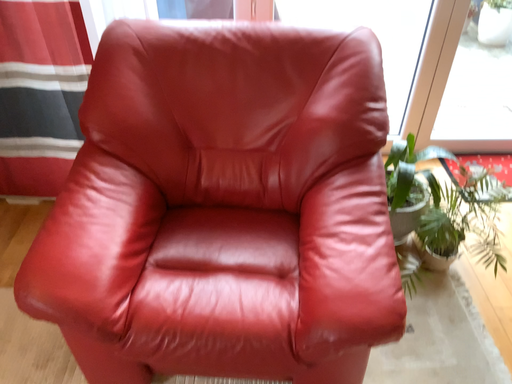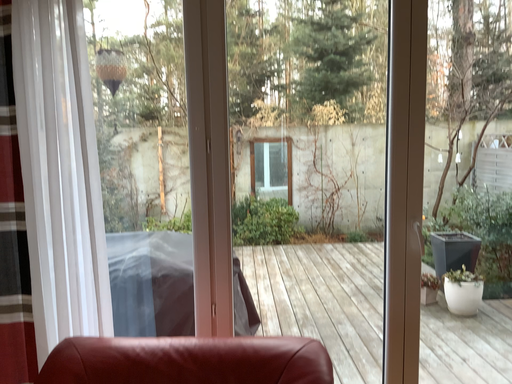
Question: Which way did the camera rotate in the video?

Choices:
 (A) rotated upward
 (B) rotated downward

Answer: (A)